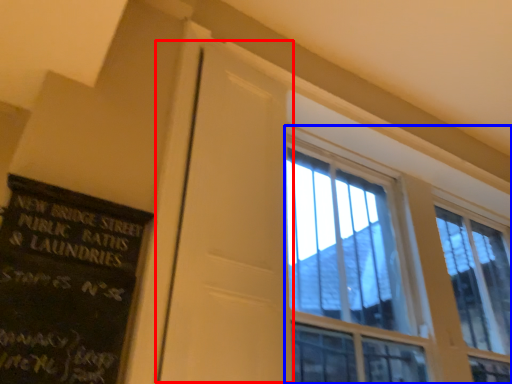
Question: Which object appears farthest to the camera in this image, screen door (highlighted by a red box) or window (highlighted by a blue box)?

Choices:
 (A) screen door
 (B) window

Answer: (B)